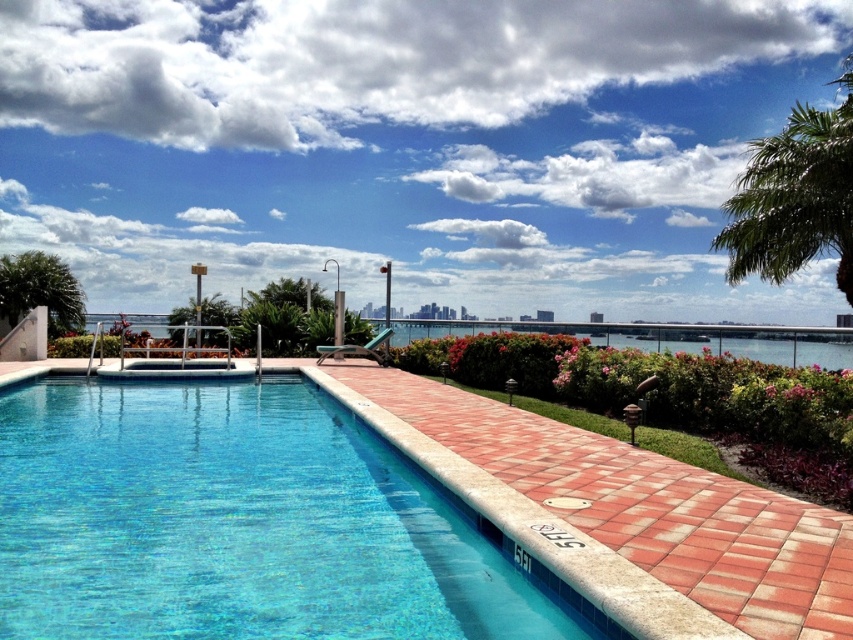
You are standing at the point labeled as point [234,522] in the image. Looking around, you see a blue tile swimming pool at center. Which direction should you face to look towards the diving board?

The diving board is positioned at one end of the blue tile swimming pool at center. Since you are at point [234,522], which indicates the location of the pool itself, you should face towards the end where the diving board is located to look towards it. However, without additional spatial information about the pool orientation, it is impossible to determine the exact direction. Please provide more details about the pool layout or the position of the diving board relative to the point.